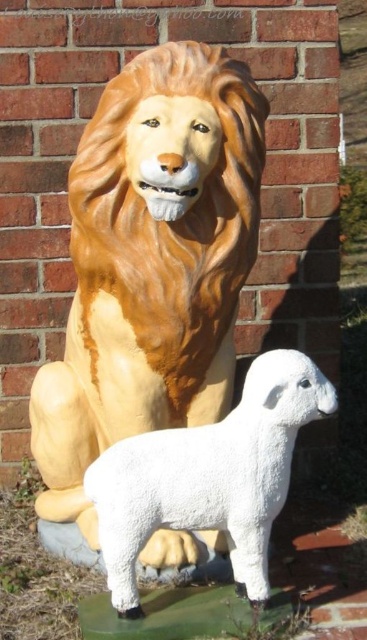
You are an art curator planning to install a new light fixture at point (151,262). Based on the scene description, which sculpture will the light fixture be placed on?

The point (151,262) is on the matte golden lion at center, so the light fixture will be placed on the matte golden lion at center.

You are standing in front of the brick wall where the matte golden lion at center and the white fluffy lamb at lower center are displayed. If you want to take a photo of both sculptures, which one should you position closer to the left side of your camera frame?

The matte golden lion at center should be positioned closer to the left side of your camera frame because it is already located to the left of the white fluffy lamb at lower center in the scene.